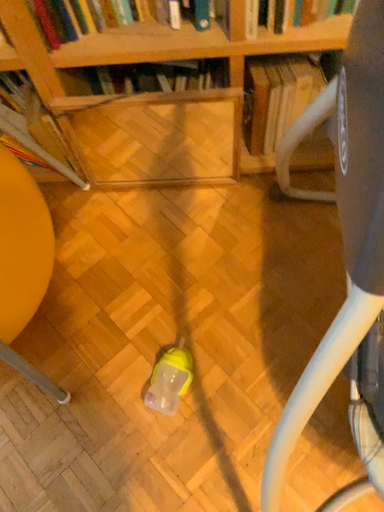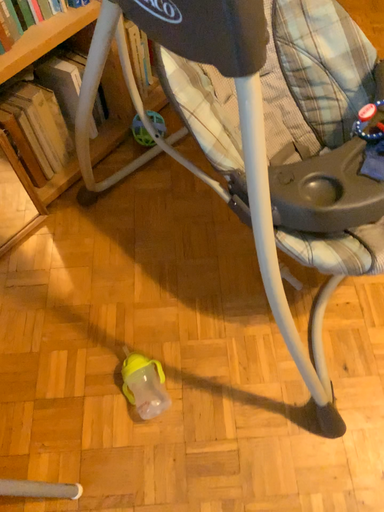
Question: How did the camera likely rotate when shooting the video?

Choices:
 (A) rotated right
 (B) rotated left

Answer: (A)